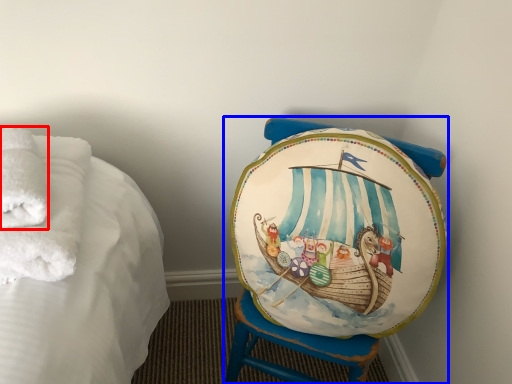
Question: Which of the following is the farthest to the observer, bath towel (highlighted by a red box) or furniture (highlighted by a blue box)?

Choices:
 (A) bath towel
 (B) furniture

Answer: (B)